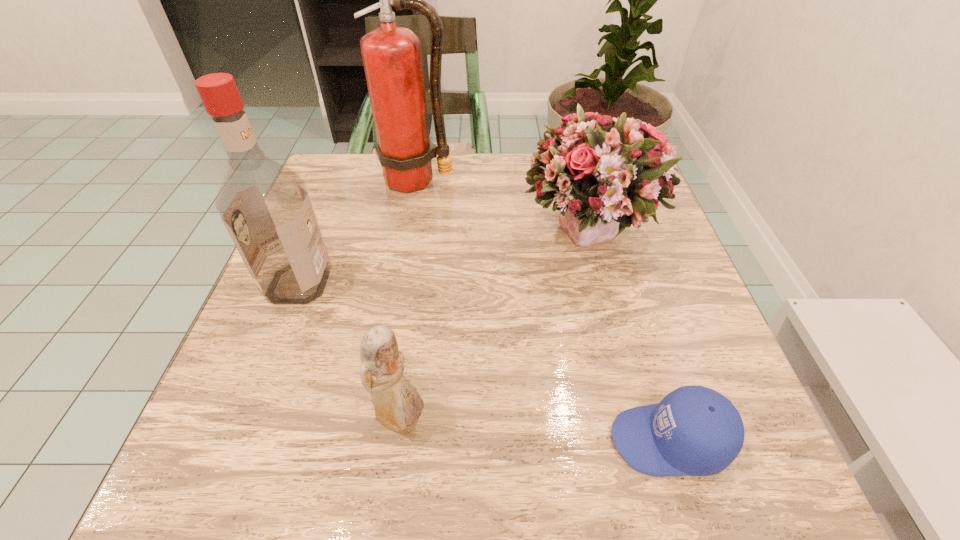
What are the coordinates of `vacant space that satisfies the following two spatial constraints: 1. at the nozzle of the fire extinguisher; 2. on the left side of the bouquet` in the screenshot? It's located at (407, 235).

This screenshot has height=540, width=960. In order to click on free space that satisfies the following two spatial constraints: 1. at the nozzle of the fire extinguisher; 2. on the left side of the bouquet in this screenshot , I will do `click(407, 235)`.

At what (x,y) coordinates should I click in order to perform the action: click on free spot that satisfies the following two spatial constraints: 1. at the nozzle of the fire extinguisher; 2. on the right side of the third shortest object. Please return your answer as a coordinate pair (x, y). Image resolution: width=960 pixels, height=540 pixels. Looking at the image, I should click on (407, 235).